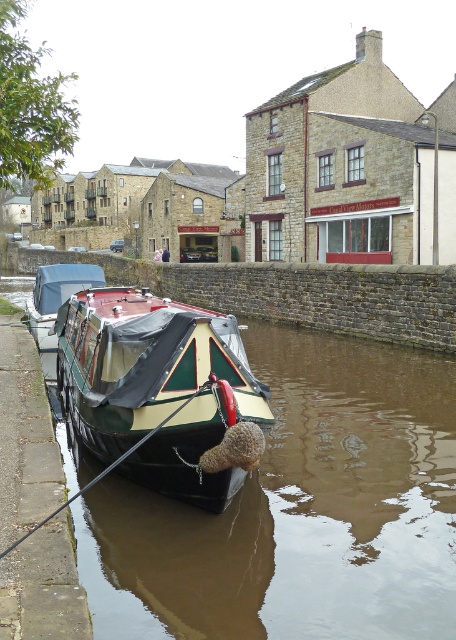
Does green painted wood boat at center appear on the left side of green polished wood boat at center?

No, green painted wood boat at center is not to the left of green polished wood boat at center.

Which is below, green painted wood boat at center or green polished wood boat at center?

green polished wood boat at center is lower down.

Describe the element at coordinates (298, 512) in the screenshot. I see `green painted wood boat at center` at that location.

Image resolution: width=456 pixels, height=640 pixels. I want to click on green painted wood boat at center, so click(x=298, y=512).

Which is more to the right, green matte boat at center or green polished wood boat at center?

Positioned to the right is green polished wood boat at center.

Locate an element on the screen. This screenshot has height=640, width=456. green matte boat at center is located at coordinates (155, 387).

Where is `green matte boat at center`? green matte boat at center is located at coordinates click(155, 387).

Does green painted wood boat at center have a lesser width compared to green matte boat at center?

No, green painted wood boat at center is not thinner than green matte boat at center.

Is green painted wood boat at center behind green matte boat at center?

No.

The height and width of the screenshot is (640, 456). What do you see at coordinates (298, 512) in the screenshot? I see `green painted wood boat at center` at bounding box center [298, 512].

The width and height of the screenshot is (456, 640). What are the coordinates of `green painted wood boat at center` in the screenshot? It's located at (298, 512).